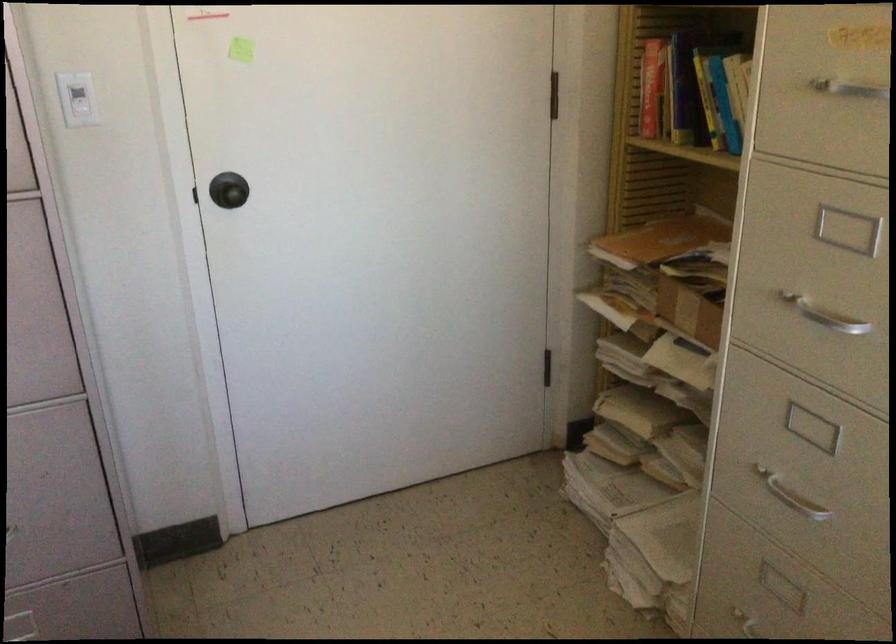
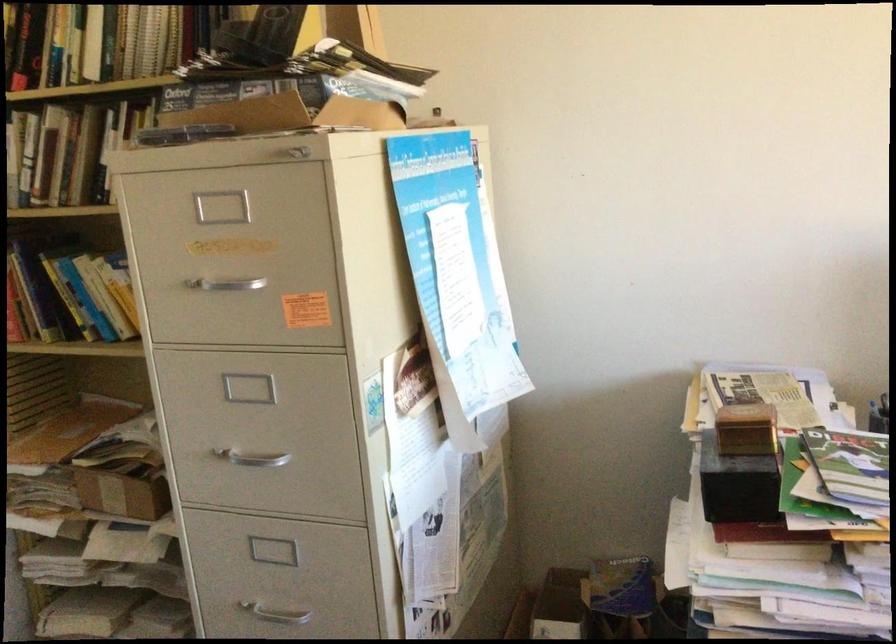
The point at (815,319) is marked in the first image. Where is the corresponding point in the second image?

(251, 458)